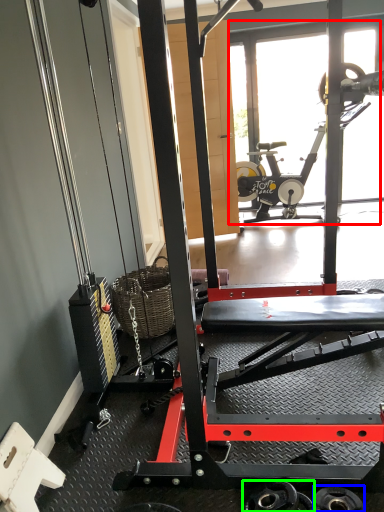
Question: Which is farther away from glass door (highlighted by a red box)? wheel (highlighted by a blue box) or wheel (highlighted by a green box)?

Choices:
 (A) wheel
 (B) wheel

Answer: (A)